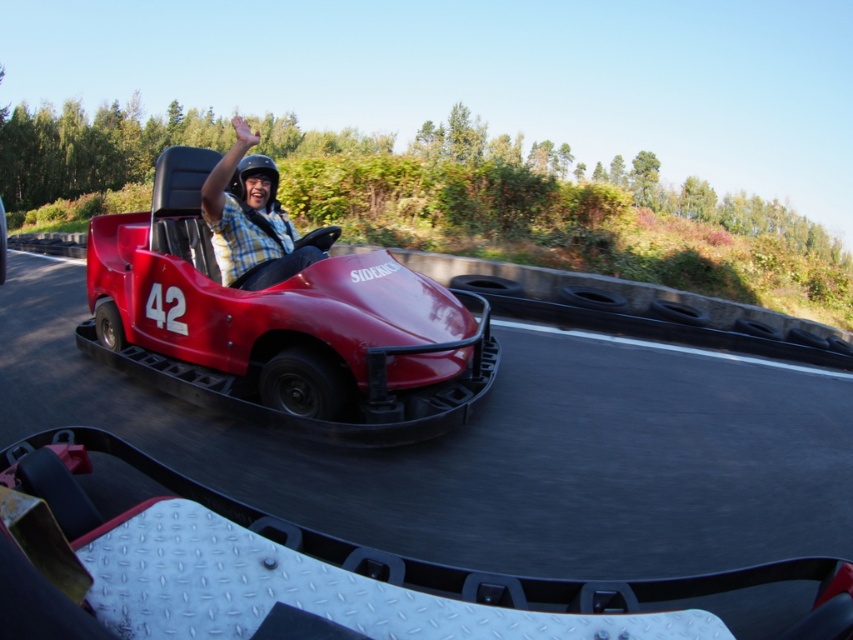
Can you confirm if red rubber race track at center is thinner than plaid shirt at center?

Indeed, red rubber race track at center has a lesser width compared to plaid shirt at center.

Does point (68, 358) lie in front of point (221, 198)?

No.

Where is `red rubber race track at center`? This screenshot has width=853, height=640. red rubber race track at center is located at coordinates coord(500,449).

Does point (45, 342) come behind point (149, 356)?

Yes.

Can you confirm if red rubber race track at center is positioned to the left of shiny red go-kart at center?

Indeed, red rubber race track at center is positioned on the left side of shiny red go-kart at center.

Is point (747, 506) positioned behind point (474, 326)?

No.

Identify the location of red rubber race track at center. click(500, 449).

Is shiny red go-kart at center positioned at the back of plaid shirt at center?

No, shiny red go-kart at center is in front of plaid shirt at center.

Is shiny red go-kart at center thinner than plaid shirt at center?

No.

Between point (302, 356) and point (265, 266), which one is positioned in front?

Point (302, 356) is in front.

Where is `shiny red go-kart at center`? The width and height of the screenshot is (853, 640). shiny red go-kart at center is located at coordinates (280, 326).